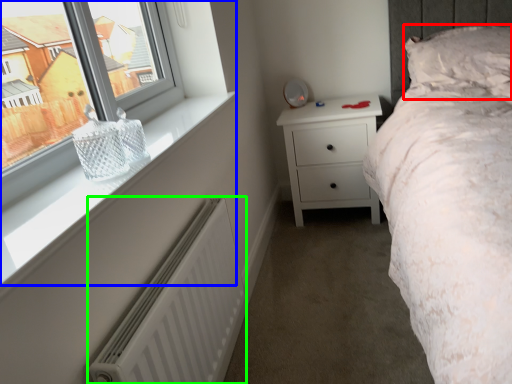
Question: Considering the real-world distances, which object is closest to pillow (highlighted by a red box)? window (highlighted by a blue box) or radiator (highlighted by a green box).

Choices:
 (A) window
 (B) radiator

Answer: (A)